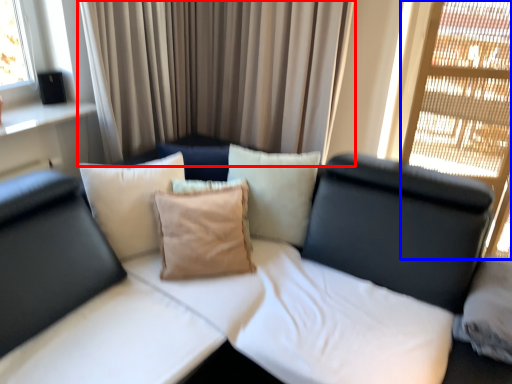
Question: Which object is further to the camera taking this photo, curtain (highlighted by a red box) or glass door (highlighted by a blue box)?

Choices:
 (A) curtain
 (B) glass door

Answer: (A)